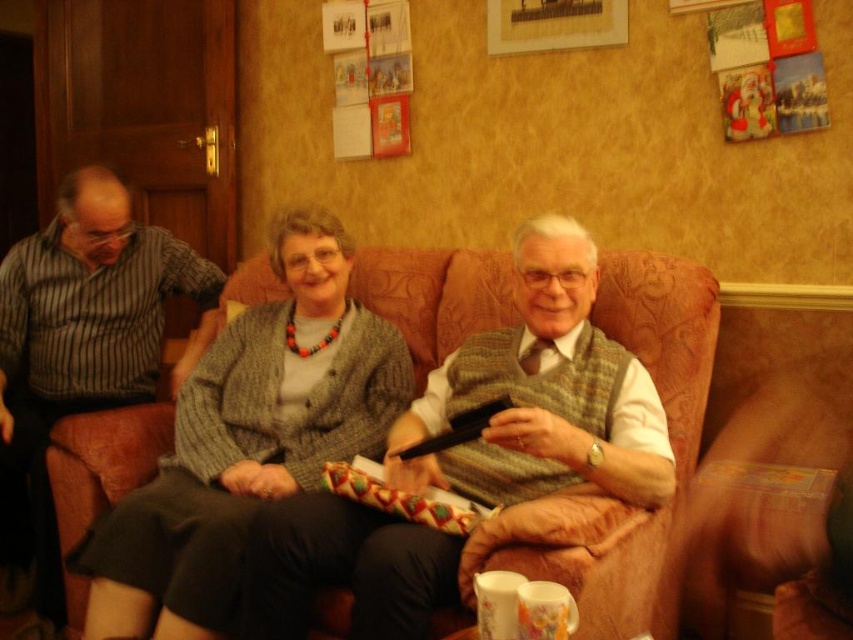
Does knitted gray sweater at center appear on the left side of striped fabric shirt at left?

Incorrect, knitted gray sweater at center is not on the left side of striped fabric shirt at left.

Who is more forward, [317,451] or [51,310]?

Point [317,451] is more forward.

Who is more forward, [340,252] or [59,394]?

Positioned in front is point [340,252].

Where is `knitted gray sweater at center`? The width and height of the screenshot is (853, 640). knitted gray sweater at center is located at coordinates (247, 440).

Does knitted gray sweater at center appear on the right side of brown fabric couch at center?

No, knitted gray sweater at center is not to the right of brown fabric couch at center.

Can you confirm if knitted gray sweater at center is positioned above brown fabric couch at center?

Yes, knitted gray sweater at center is above brown fabric couch at center.

Which is in front, point (227, 580) or point (450, 257)?

Point (227, 580) is more forward.

Where is `knitted gray sweater at center`? This screenshot has width=853, height=640. knitted gray sweater at center is located at coordinates (247, 440).

Who is shorter, brown fabric couch at center or striped fabric shirt at left?

Standing shorter between the two is brown fabric couch at center.

Based on the photo, who is more forward, (x=85, y=433) or (x=184, y=259)?

Point (x=85, y=433)

What do you see at coordinates (664, 333) in the screenshot? I see `brown fabric couch at center` at bounding box center [664, 333].

I want to click on brown fabric couch at center, so click(664, 333).